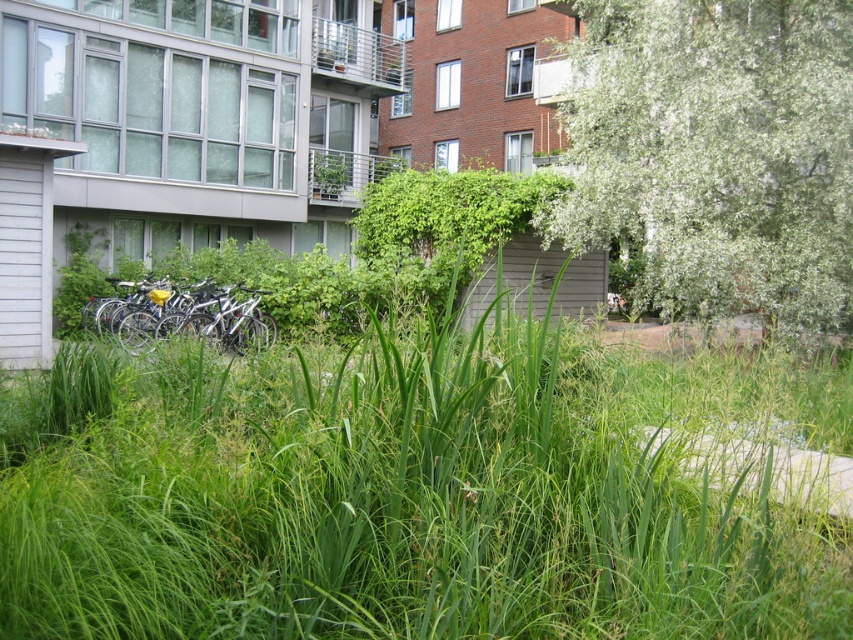
Question: Which point is farther to the camera?

Choices:
 (A) silver metallic bicycle at left
 (B) white fluffy tree at upper right

Answer: (A)

Question: Estimate the real-world distances between objects in this image. Which object is closer to the silver metallic bicycle at left?

Choices:
 (A) green leafy grass at center
 (B) white fluffy tree at upper right

Answer: (A)

Question: Among these objects, which one is nearest to the camera?

Choices:
 (A) white fluffy tree at upper right
 (B) green leafy grass at center
 (C) silver metallic bicycle at left

Answer: (B)

Question: Does green leafy grass at center appear under silver metallic bicycle at left?

Choices:
 (A) yes
 (B) no

Answer: (A)

Question: Considering the relative positions of green leafy grass at center and silver metallic bicycle at left in the image provided, where is green leafy grass at center located with respect to silver metallic bicycle at left?

Choices:
 (A) right
 (B) left

Answer: (A)

Question: Can you confirm if green leafy grass at center is positioned below white fluffy tree at upper right?

Choices:
 (A) yes
 (B) no

Answer: (A)